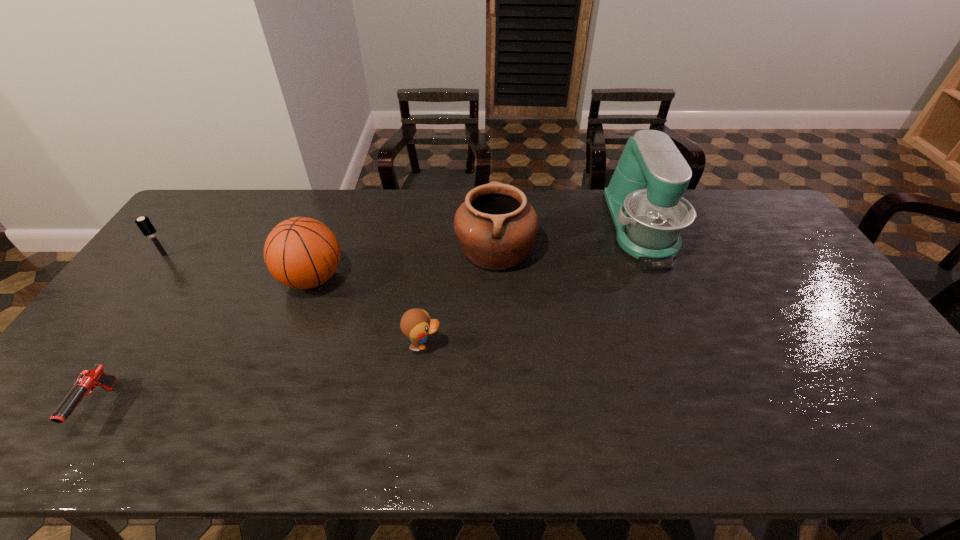
I want to click on free space at the far edge of the desktop, so click(x=539, y=219).

Where is `free point at the near edge`? free point at the near edge is located at coordinates (340, 432).

This screenshot has width=960, height=540. What are the coordinates of `vacant space at the left edge` in the screenshot? It's located at (158, 326).

In the image, there is a desktop. Identify the location of free space at the right edge. (774, 260).

Where is `vacant region between the rightmost object and the second nearest object`? Image resolution: width=960 pixels, height=540 pixels. vacant region between the rightmost object and the second nearest object is located at coordinates (532, 287).

Find the location of a particular element. This screenshot has height=540, width=960. empty location between the hairbrush and the second object from left to right is located at coordinates (132, 331).

Where is `vacant area that lies between the hairbrush and the rightmost object`? This screenshot has height=540, width=960. vacant area that lies between the hairbrush and the rightmost object is located at coordinates (403, 242).

At what (x,y) coordinates should I click in order to perform the action: click on free space between the pottery and the basketball. Please return your answer as a coordinate pair (x, y). This screenshot has height=540, width=960. Looking at the image, I should click on (404, 265).

Image resolution: width=960 pixels, height=540 pixels. I want to click on vacant space that is in between the second nearest object and the pottery, so click(459, 298).

At what (x,y) coordinates should I click in order to perform the action: click on free space between the pottery and the basketball. Please return your answer as a coordinate pair (x, y). The height and width of the screenshot is (540, 960). Looking at the image, I should click on (404, 265).